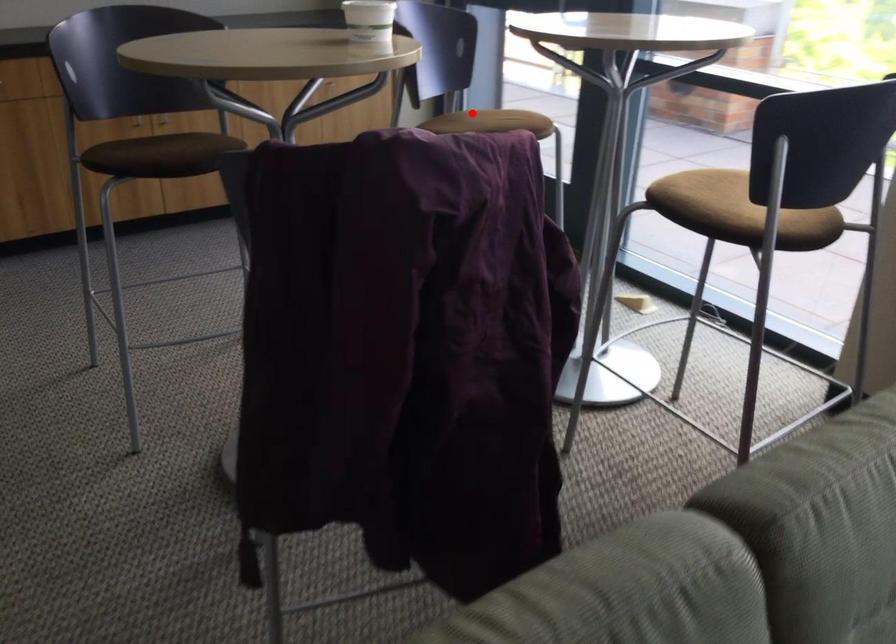
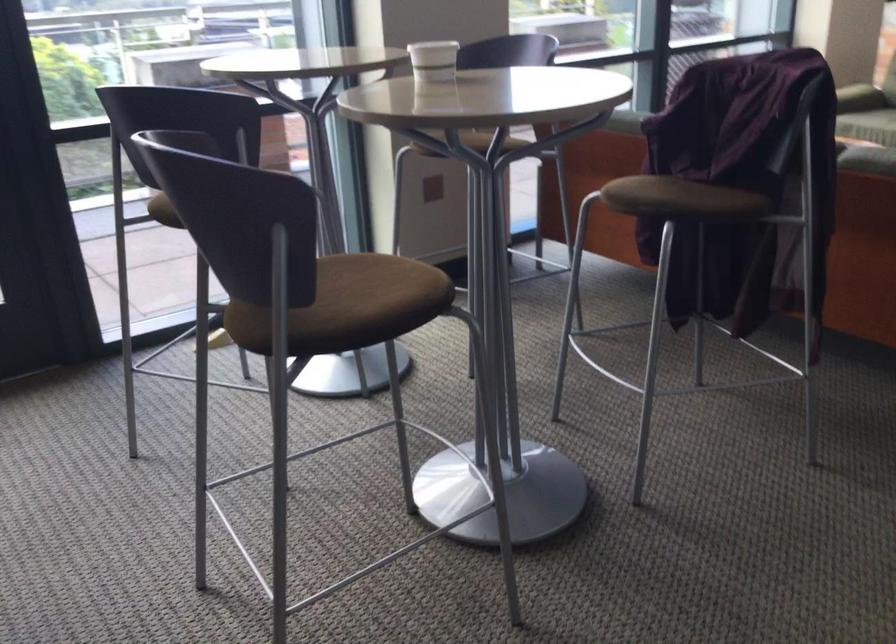
In the second image, find the point that corresponds to the highlighted location in the first image.

(162, 211)